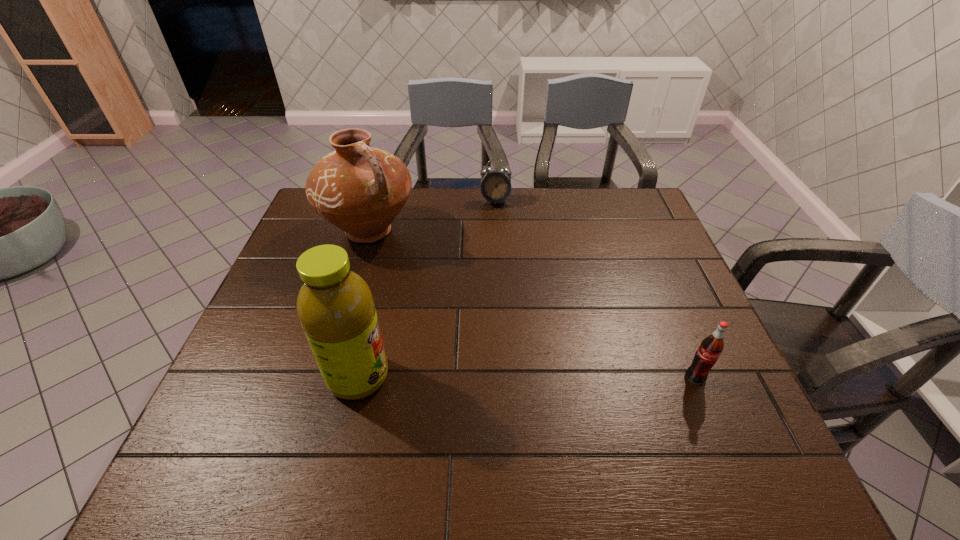
This screenshot has width=960, height=540. In order to click on vacant space on the desktop that is between the fruit juice and the rightmost object and is positioned on the face of the alarm clock in this screenshot , I will do `click(501, 377)`.

Find the location of a particular element. free space on the desktop that is between the fruit juice and the rightmost object and is positioned on the side of the pottery with the handle is located at coordinates (494, 377).